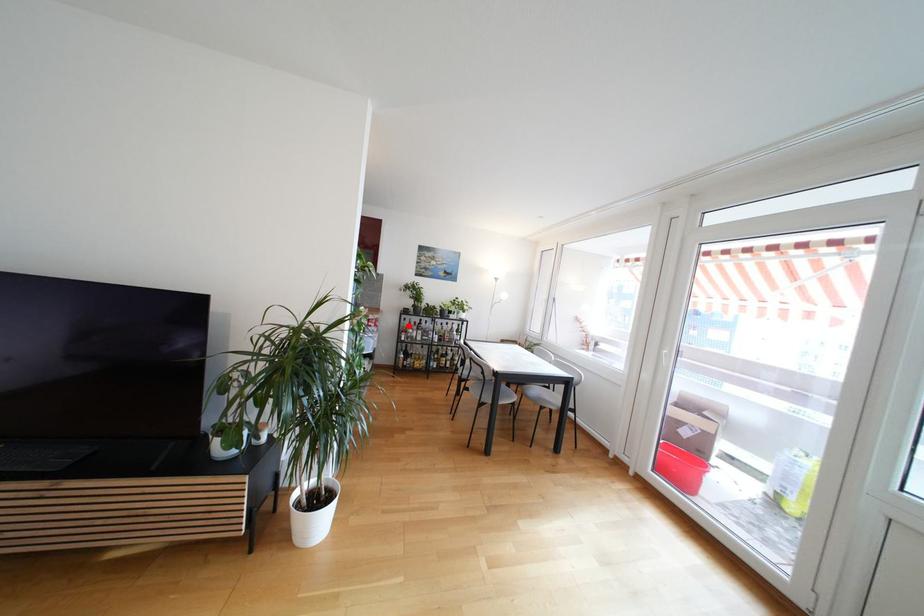
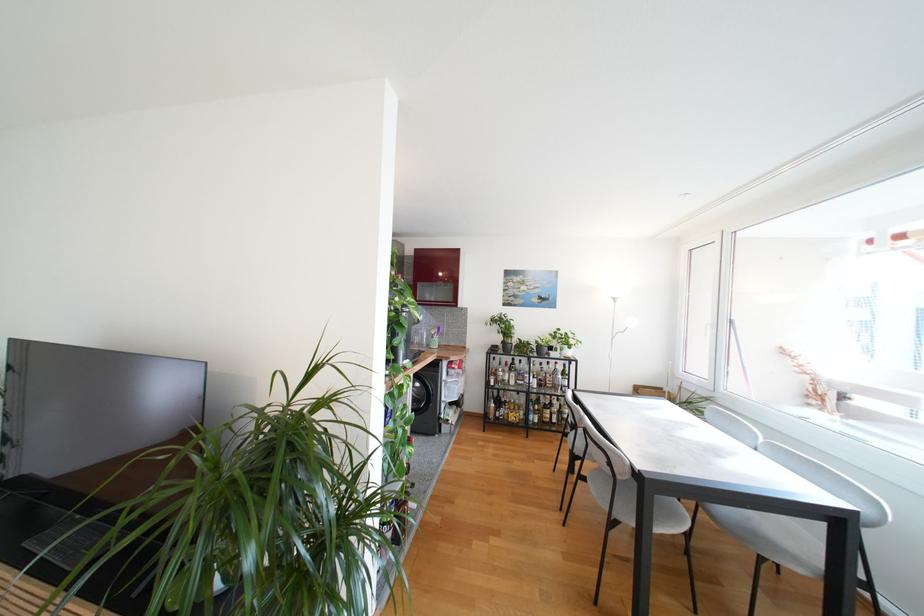
Question: I am providing you with two images of the same scene from different viewpoints. Given a red point in image1, look at the same physical point in image2. Is it:

Choices:
 (A) Closer to the viewpoint
 (B) Farther from the viewpoint

Answer: (B)